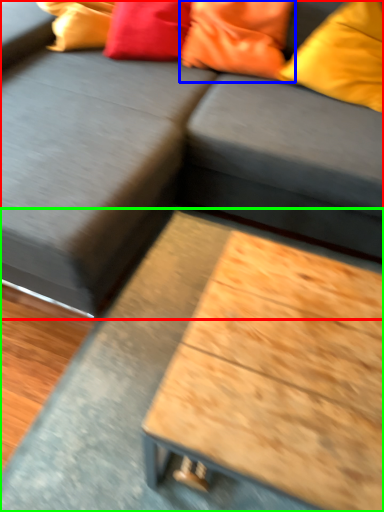
Question: Estimate the real-world distances between objects in this image. Which object is closer to studio couch (highlighted by a red box), pillow (highlighted by a blue box) or table (highlighted by a green box)?

Choices:
 (A) pillow
 (B) table

Answer: (B)